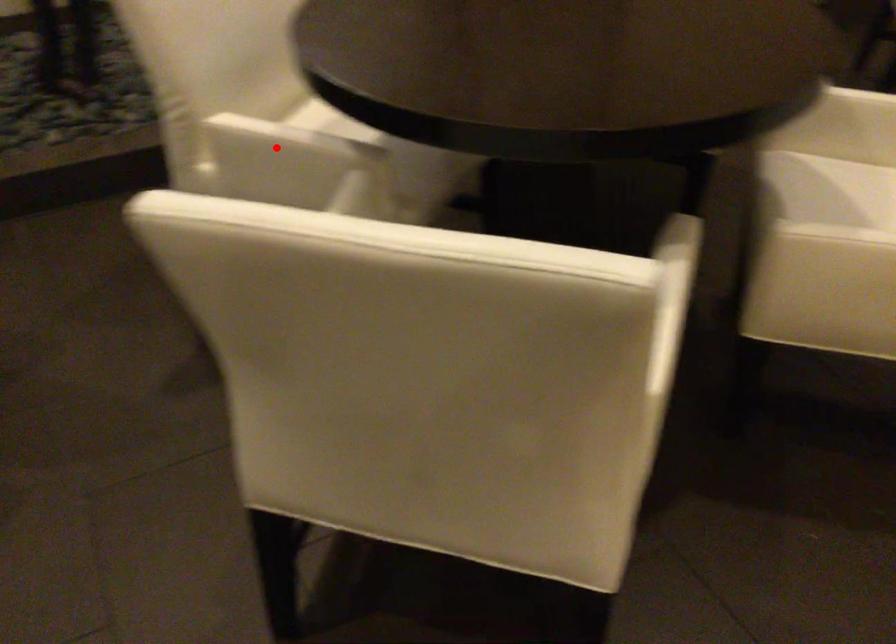
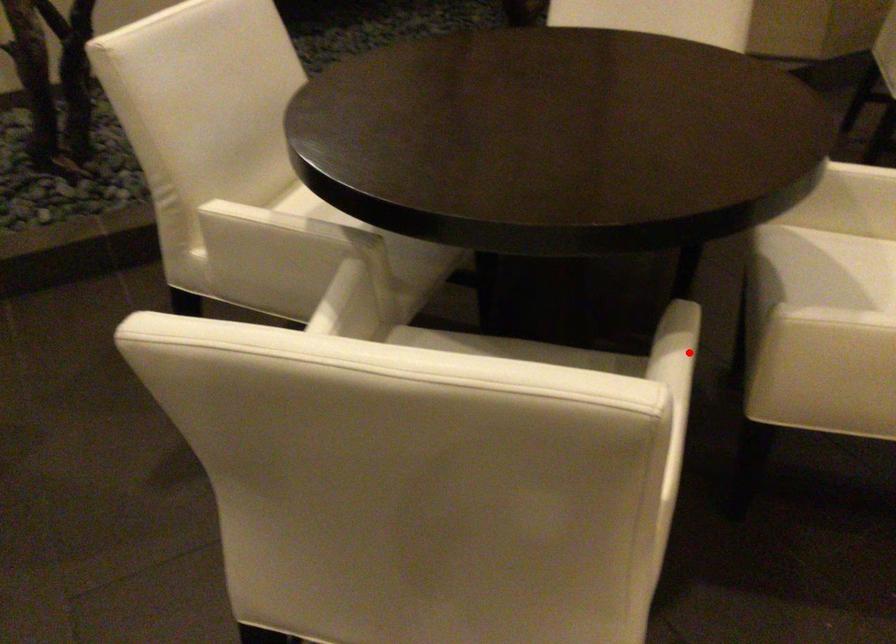
I am providing you with two images of the same scene from different viewpoints. A red point is marked on the first image and another point is marked on the second image. Do the highlighted points in image1 and image2 indicate the same real-world spot?

No